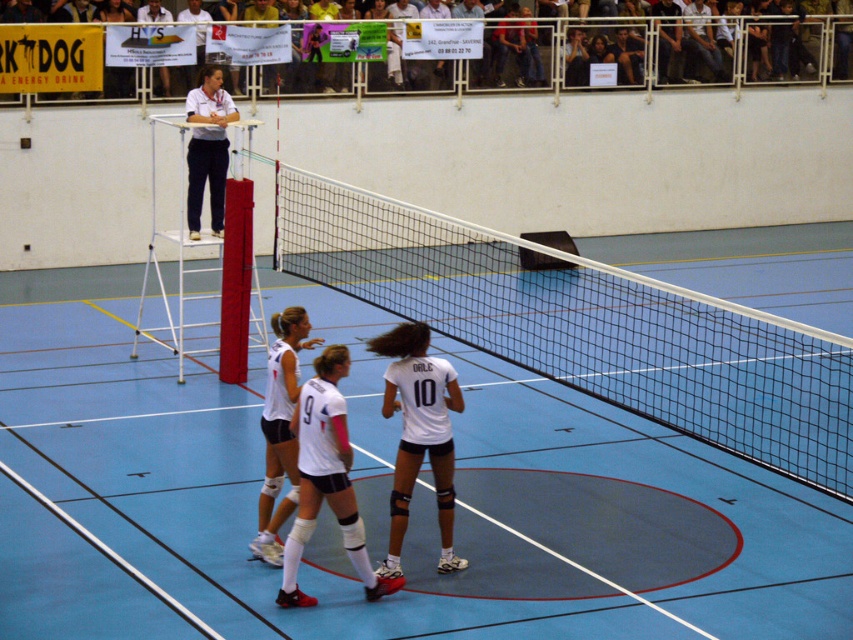
You are a player in the volleyball match. Your teammate has just hit the ball towards the point marked at coordinates (326, 477). What object is located at that point?

The point marked at coordinates (326, 477) indicates the location of the white matte shorts at center.

You are a photographer positioned at the back of the court. You need to capture a closeup shot of the white matte shorts at center and the white matte uniform at center. Which object should you zoom in on first to ensure it fits entirely within your camera frame?

The white matte shorts at center has a larger width than the white matte uniform at center, so you should zoom in on the white matte shorts at center first to ensure it fits entirely within your camera frame.